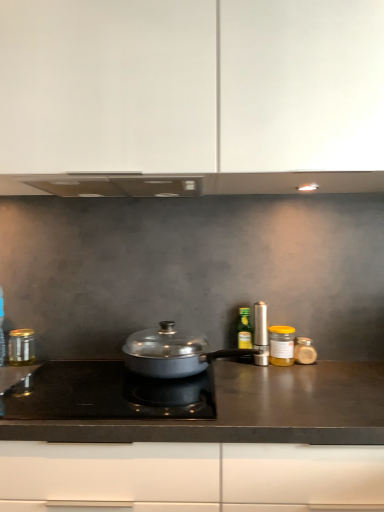
Question: Considering the relative sizes of silver metallic salt shaker at right, the 3th kitchen appliance positioned from the right, and black matte countertop at center in the image provided, is silver metallic salt shaker at right, the 3th kitchen appliance positioned from the right, shorter than black matte countertop at center?

Choices:
 (A) no
 (B) yes

Answer: (B)

Question: From the image's perspective, is silver metallic salt shaker at right, which is counted as the fourth kitchen appliance, starting from the left, located beneath black matte countertop at center?

Choices:
 (A) no
 (B) yes

Answer: (A)

Question: Is silver metallic salt shaker at right, which is counted as the fourth kitchen appliance, starting from the left, taller than black matte countertop at center?

Choices:
 (A) no
 (B) yes

Answer: (A)

Question: Is silver metallic salt shaker at right, the 3th kitchen appliance positioned from the right, bigger than black matte countertop at center?

Choices:
 (A) no
 (B) yes

Answer: (A)

Question: From a real-world perspective, does silver metallic salt shaker at right, the 3th kitchen appliance positioned from the right, stand above black matte countertop at center?

Choices:
 (A) no
 (B) yes

Answer: (B)

Question: Is silver metallic salt shaker at right, which is counted as the fourth kitchen appliance, starting from the left, turned away from black matte countertop at center?

Choices:
 (A) yes
 (B) no

Answer: (B)

Question: Is silver metallic salt shaker at right, which is counted as the fourth kitchen appliance, starting from the left, in front of black glass cooktop at center?

Choices:
 (A) no
 (B) yes

Answer: (A)

Question: Is black glass cooktop at center completely or partially inside silver metallic salt shaker at right, which is counted as the fourth kitchen appliance, starting from the left?

Choices:
 (A) no
 (B) yes

Answer: (A)

Question: From the image's perspective, is silver metallic salt shaker at right, which is counted as the fourth kitchen appliance, starting from the left, located beneath black glass cooktop at center?

Choices:
 (A) yes
 (B) no

Answer: (B)

Question: Does silver metallic salt shaker at right, which is counted as the fourth kitchen appliance, starting from the left, appear on the right side of black glass cooktop at center?

Choices:
 (A) no
 (B) yes

Answer: (B)

Question: Is silver metallic salt shaker at right, the 3th kitchen appliance positioned from the right, facing away from black glass cooktop at center?

Choices:
 (A) yes
 (B) no

Answer: (B)

Question: Is silver metallic salt shaker at right, which is counted as the fourth kitchen appliance, starting from the left, positioned beyond the bounds of black glass cooktop at center?

Choices:
 (A) no
 (B) yes

Answer: (B)

Question: Could you tell me if white matte cabinet at upper center is facing translucent glass jar at right, acting as the 6th kitchen appliance starting from the left?

Choices:
 (A) yes
 (B) no

Answer: (B)